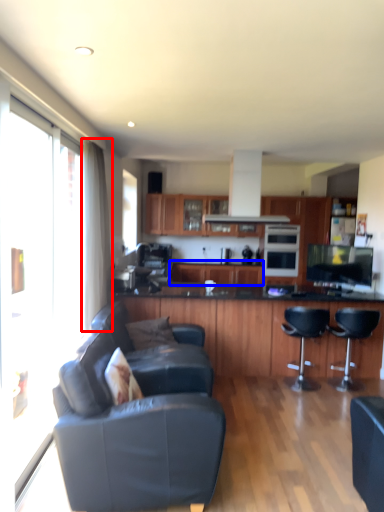
Question: Among these objects, which one is farthest to the camera, curtain (highlighted by a red box) or cabinetry (highlighted by a blue box)?

Choices:
 (A) curtain
 (B) cabinetry

Answer: (B)